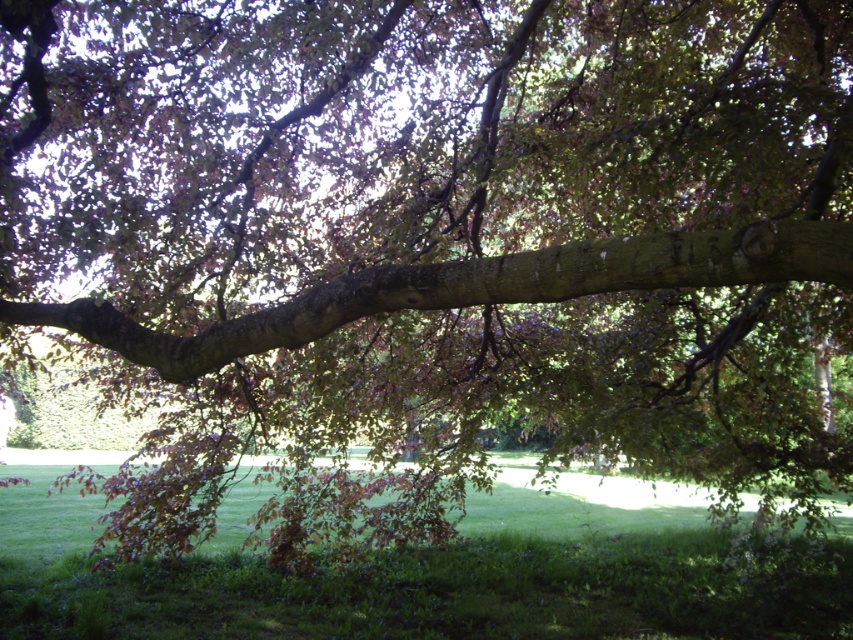
You are a gardener who needs to place a 20 foot long ladder between the green grassy at lower center and the smooth brown branch at center. Can the ladder fit between them without bending?

The distance between the green grassy at lower center and the smooth brown branch at center is 20.18 feet, so the 20 foot long ladder can fit between them without bending since the space is slightly larger than the ladder.

You are standing in the middle of the large tree with sprawling branches. You see a point at coordinates point (434, 579). What is located at that point?

The green grassy area at lower center is located at point (434, 579).